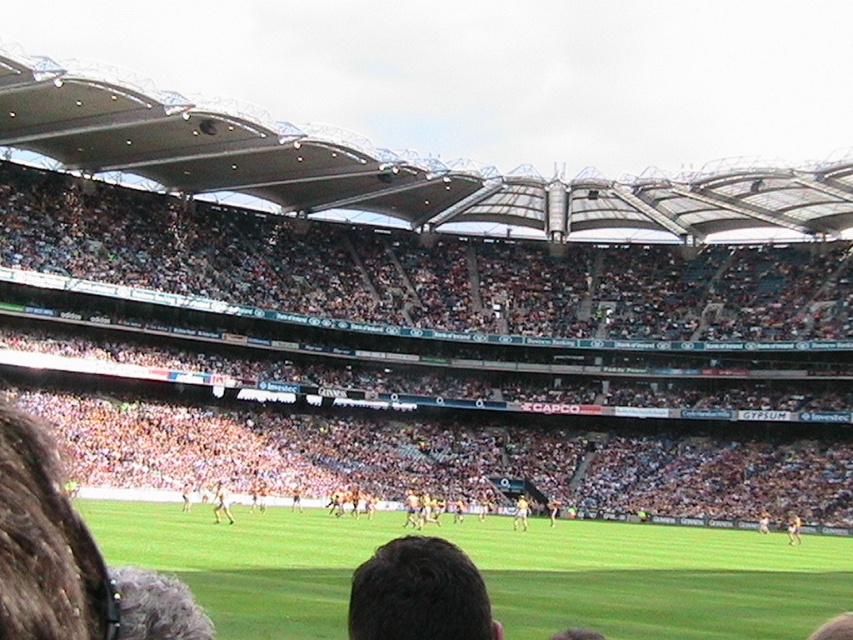
You are a photographer standing at the edge of the field in the stadium. You want to take a photo that includes both the point at coordinates point [219,499] and point [525,522]. Which point should you focus on first to ensure both are in sharp focus?

You should focus on point [219,499] first because it is closer to the camera than point [525,522]. This ensures the closer point is in focus, and the farther point will also be within the depth of field.

You are a photographer at the stadium and want to capture a clear photo of the light brown leather shoe at center without the light brown leather person at center blocking it. What should you do?

Move the camera backward to create more distance between the light brown leather person at center and the light brown leather shoe at center, allowing the shoe to be visible without obstruction.